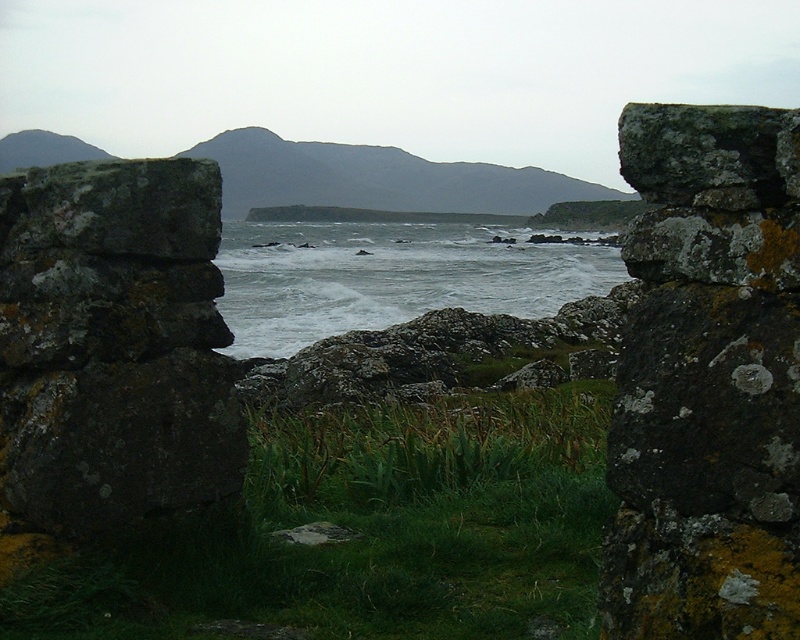
You are standing at the point marked as point (x=364, y=532) in the image. Looking around, you see the green grassy patch at center. Which direction should you walk to reach the green grassy patch at center?

You are already standing at the point where the green grassy patch at center is located, so you don t need to walk anywhere else.